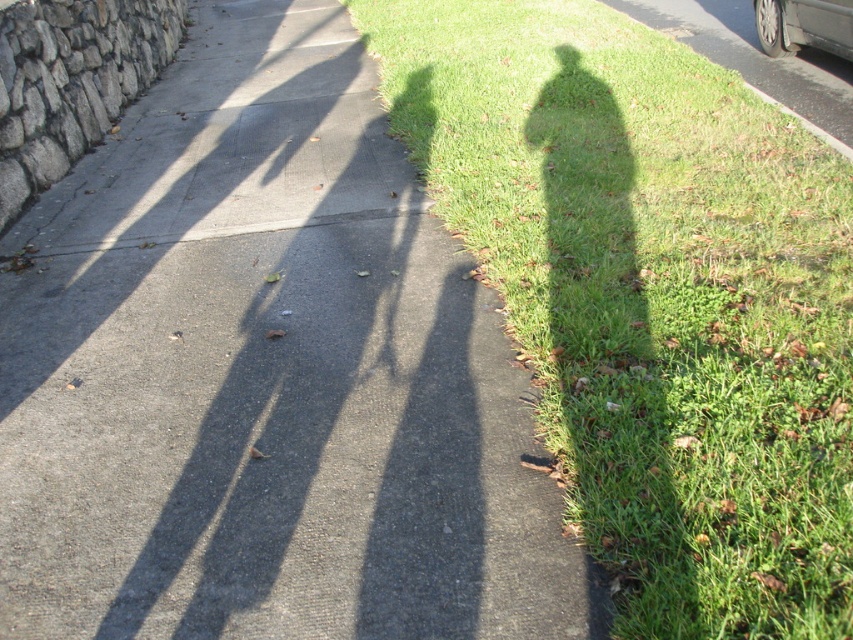
Is green grass at upper right above metallic gray car at upper right?

Actually, green grass at upper right is below metallic gray car at upper right.

Between point (814, 150) and point (808, 45), which one is positioned in front?

Point (814, 150) is in front.

Locate an element on the screen. green grass at upper right is located at coordinates (653, 298).

Looking at this image, is gray asphalt sidewalk at center positioned behind green grass at upper right?

Yes, gray asphalt sidewalk at center is further from the viewer.

Can you confirm if gray asphalt sidewalk at center is thinner than green grass at upper right?

Correct, gray asphalt sidewalk at center's width is less than green grass at upper right's.

What do you see at coordinates (265, 376) in the screenshot? Image resolution: width=853 pixels, height=640 pixels. I see `gray asphalt sidewalk at center` at bounding box center [265, 376].

You are a GUI agent. You are given a task and a screenshot of the screen. Output one action in this format:
    pyautogui.click(x=<x>, y=<y>)
    Task: Click on the gray asphalt sidewalk at center
    This screenshot has height=640, width=853.
    Given the screenshot: What is the action you would take?
    pyautogui.click(x=265, y=376)

Is gray asphalt sidewalk at center positioned before metallic gray car at upper right?

Yes.

Image resolution: width=853 pixels, height=640 pixels. Describe the element at coordinates (265, 376) in the screenshot. I see `gray asphalt sidewalk at center` at that location.

Is point (3, 481) positioned behind point (793, 51)?

That is False.

Find the location of a particular element. This screenshot has width=853, height=640. gray asphalt sidewalk at center is located at coordinates (265, 376).